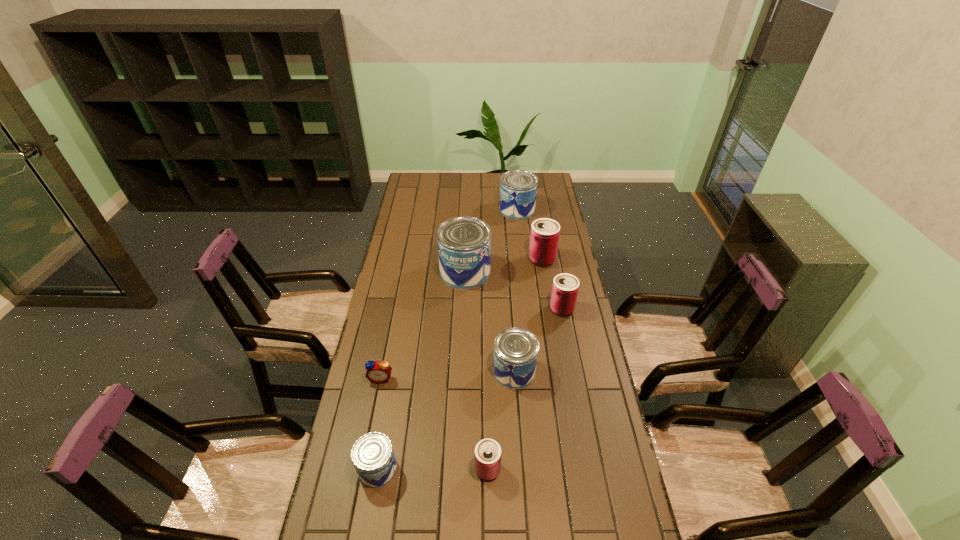
This screenshot has height=540, width=960. I want to click on the second closest blue can to the nearest blue can, so click(x=464, y=243).

Locate which blue can is the closest to the third nearest can. Please provide its 2D coordinates. Your answer should be formatted as a tuple, i.e. [(x, y)], where the tuple contains the x and y coordinates of a point satisfying the conditions above.

[(464, 243)]

What are the coordinates of `the closest pink can to the nearest pink can` in the screenshot? It's located at [565, 287].

Where is `pink can that is the closest one to the second smallest blue can`? This screenshot has height=540, width=960. pink can that is the closest one to the second smallest blue can is located at coordinates (565, 287).

This screenshot has width=960, height=540. What are the coordinates of `vacant space that satisfies the following two spatial constraints: 1. on the front label of the biggest pink can; 2. on the right side of the farthest object` in the screenshot? It's located at (522, 259).

This screenshot has width=960, height=540. In order to click on free space that satisfies the following two spatial constraints: 1. on the front label of the smallest pink can; 2. on the left side of the biggest blue can in this screenshot , I will do `click(457, 469)`.

Image resolution: width=960 pixels, height=540 pixels. Identify the location of vacant space that satisfies the following two spatial constraints: 1. on the front label of the third farthest blue can; 2. on the front label of the nearest blue can. (521, 469).

Identify the location of free spot that satisfies the following two spatial constraints: 1. on the front label of the tallest can; 2. on the right side of the leftmost pink can. This screenshot has width=960, height=540. (457, 469).

At what (x,y) coordinates should I click in order to perform the action: click on vacant space that satisfies the following two spatial constraints: 1. on the front label of the leftmost blue can; 2. on the left side of the nearest pink can. Please return your answer as a coordinate pair (x, y). The image size is (960, 540). Looking at the image, I should click on (377, 469).

What are the coordinates of `vacant space that satisfies the following two spatial constraints: 1. on the front label of the farthest can; 2. on the front-facing side of the alarm clock` in the screenshot? It's located at (536, 378).